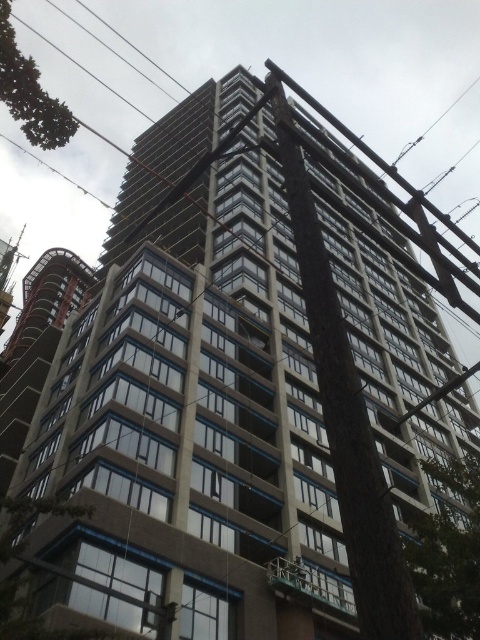
Who is positioned more to the left, green leafy tree at lower right or green leafy tree at upper left?

From the viewer's perspective, green leafy tree at upper left appears more on the left side.

Between green leafy tree at lower right and green leafy tree at upper left, which one appears on the right side from the viewer's perspective?

Positioned to the right is green leafy tree at lower right.

Describe the element at coordinates (448, 554) in the screenshot. I see `green leafy tree at lower right` at that location.

At what (x,y) coordinates should I click in order to perform the action: click on green leafy tree at lower right. Please return your answer as a coordinate pair (x, y). Looking at the image, I should click on (448, 554).

Can you confirm if green leafy tree at upper left is positioned to the left of black wire at upper left?

In fact, green leafy tree at upper left is to the right of black wire at upper left.

Measure the distance between green leafy tree at upper left and camera.

green leafy tree at upper left is 28.71 meters from camera.

The width and height of the screenshot is (480, 640). What do you see at coordinates (29, 92) in the screenshot?
I see `green leafy tree at upper left` at bounding box center [29, 92].

This screenshot has width=480, height=640. What are the coordinates of `green leafy tree at upper left` in the screenshot? It's located at (29, 92).

Does concrete at center have a lesser height compared to green leafy tree at upper left?

In fact, concrete at center may be taller than green leafy tree at upper left.

Describe the element at coordinates (346, 416) in the screenshot. I see `concrete at center` at that location.

What do you see at coordinates (346, 416) in the screenshot?
I see `concrete at center` at bounding box center [346, 416].

Where is `concrete at center`? The width and height of the screenshot is (480, 640). concrete at center is located at coordinates (346, 416).